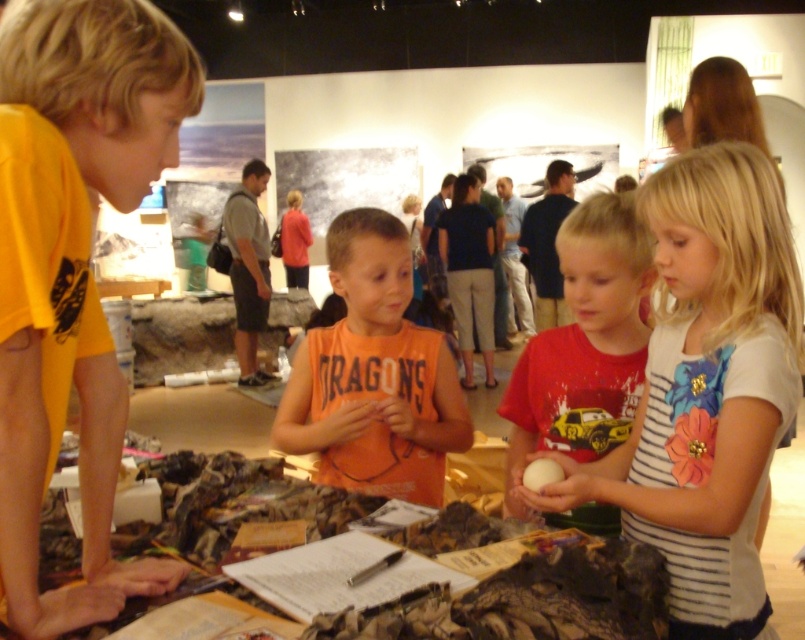
Question: Can you confirm if white matte egg at center is positioned above orange cotton shirt at center?

Choices:
 (A) yes
 (B) no

Answer: (B)

Question: Estimate the real-world distances between objects in this image. Which object is farther from the white striped shirt at center?

Choices:
 (A) red cotton shirt at center
 (B) yellow matte shirt at left

Answer: (B)

Question: Considering the relative positions of yellow matte shirt at left and white matte egg at center in the image provided, where is yellow matte shirt at left located with respect to white matte egg at center?

Choices:
 (A) below
 (B) above

Answer: (B)

Question: Which of these objects is positioned closest to the yellow matte shirt at left?

Choices:
 (A) red cotton shirt at center
 (B) white striped shirt at center
 (C) orange cotton shirt at center

Answer: (C)

Question: From the image, what is the correct spatial relationship of yellow matte shirt at left in relation to red cotton shirt at center?

Choices:
 (A) left
 (B) right

Answer: (A)

Question: Which point is farther to the camera?

Choices:
 (A) (370, 310)
 (B) (10, 596)

Answer: (A)